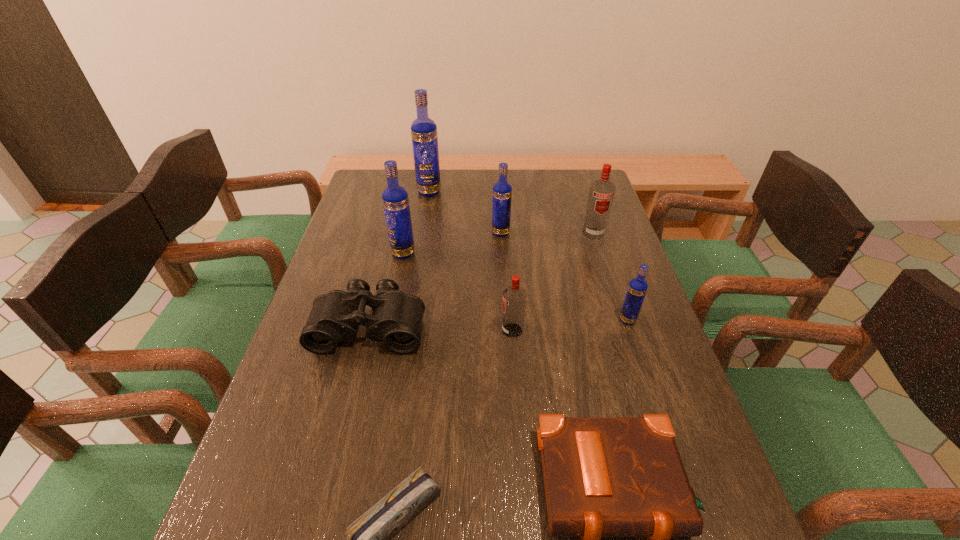
This screenshot has width=960, height=540. I want to click on the nearest blue vodka, so click(x=637, y=288).

Where is `the rightmost blue vodka`? The width and height of the screenshot is (960, 540). the rightmost blue vodka is located at coordinates (637, 288).

Locate an element on the screen. This screenshot has height=540, width=960. black binoculars is located at coordinates (396, 320).

Find the location of a particular element. Image resolution: width=960 pixels, height=540 pixels. the seventh tallest object is located at coordinates (396, 320).

Identify the location of vacant area located on the back of the tallest object. (433, 168).

At what (x,y) coordinates should I click in order to perform the action: click on vacant space located on the left of the fourth farthest object. Please return your answer as a coordinate pair (x, y). The image size is (960, 540). Looking at the image, I should click on (362, 253).

Identify the location of vacant space located on the right of the second smallest blue vodka. (557, 232).

I want to click on free region located on the front label of the right red vodka, so click(605, 269).

This screenshot has height=540, width=960. Identify the location of free space located 0.390m on the front label of the nearer red vodka. (347, 330).

Where is `free spot located 0.170m on the front label of the nearer red vodka`? free spot located 0.170m on the front label of the nearer red vodka is located at coordinates (434, 330).